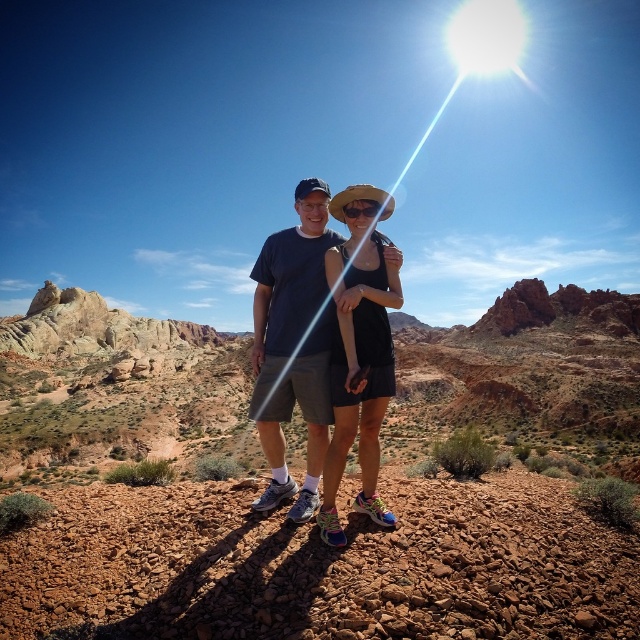
Is dark blue t-shirt at center to the right of matte black tank top at center from the viewer's perspective?

No, dark blue t-shirt at center is not to the right of matte black tank top at center.

Which is more to the left, dark blue t-shirt at center or matte black tank top at center?

Positioned to the left is dark blue t-shirt at center.

Describe the element at coordinates (292, 346) in the screenshot. The width and height of the screenshot is (640, 640). I see `dark blue t-shirt at center` at that location.

Where is `dark blue t-shirt at center`? The width and height of the screenshot is (640, 640). dark blue t-shirt at center is located at coordinates (292, 346).